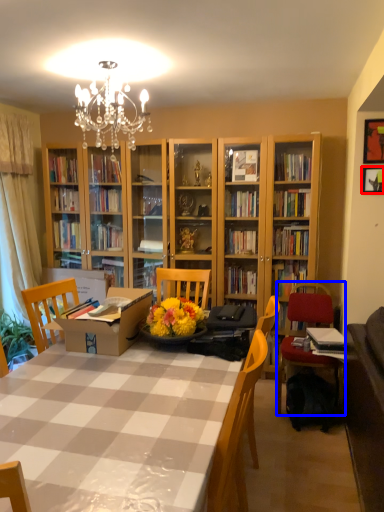
Question: Which of the following is the closest to the observer, picture frame (highlighted by a red box) or chair (highlighted by a blue box)?

Choices:
 (A) picture frame
 (B) chair

Answer: (B)